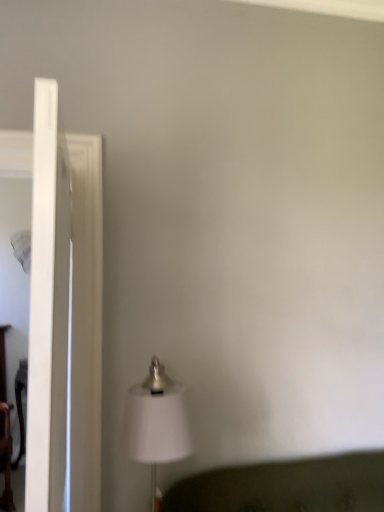
Question: In terms of height, does white fabric lampshade at lower center look taller or shorter compared to clear glass door at left?

Choices:
 (A) short
 (B) tall

Answer: (A)

Question: Is point (139, 421) positioned closer to the camera than point (44, 314)?

Choices:
 (A) closer
 (B) farther

Answer: (B)

Question: Visually, is white fabric lampshade at lower center positioned to the left or to the right of clear glass door at left?

Choices:
 (A) left
 (B) right

Answer: (B)

Question: Is clear glass door at left taller or shorter than white fabric lampshade at lower center?

Choices:
 (A) short
 (B) tall

Answer: (B)

Question: Is clear glass door at left inside the boundaries of white fabric lampshade at lower center, or outside?

Choices:
 (A) outside
 (B) inside

Answer: (A)

Question: In terms of width, does clear glass door at left look wider or thinner when compared to white fabric lampshade at lower center?

Choices:
 (A) thin
 (B) wide

Answer: (A)

Question: Is point (x=39, y=496) positioned closer to the camera than point (x=182, y=420)?

Choices:
 (A) closer
 (B) farther

Answer: (A)